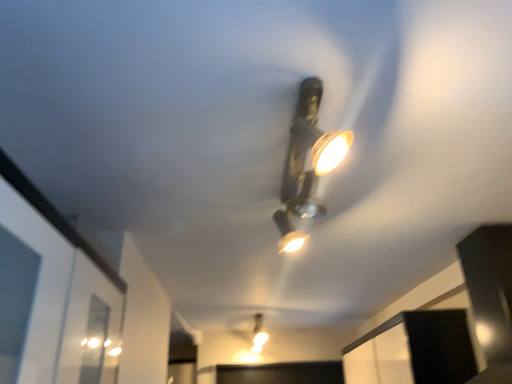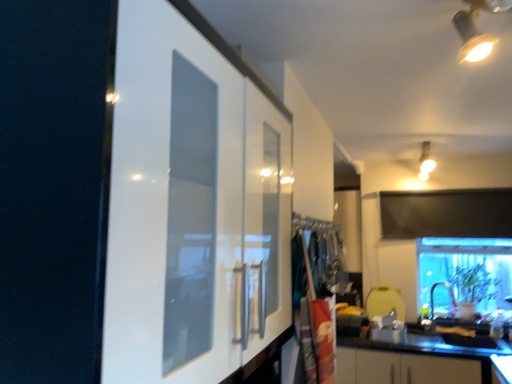
Question: How did the camera likely rotate when shooting the video?

Choices:
 (A) rotated upward
 (B) rotated downward

Answer: (B)